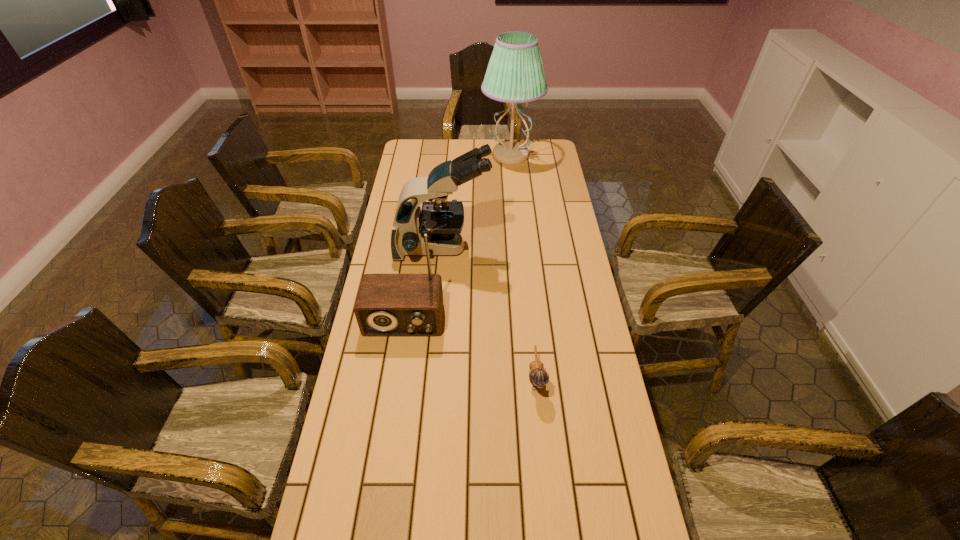
Identify the location of free location located 0.160m on the front-facing side of the second shortest object. (394, 385).

Find the location of a particular element. This screenshot has height=540, width=960. vacant space located on the front-facing side of the shortest object is located at coordinates (541, 429).

Locate an element on the screen. Image resolution: width=960 pixels, height=540 pixels. object present at the far edge is located at coordinates (515, 74).

At what (x,y) coordinates should I click in order to perform the action: click on microscope positioned at the left edge. Please return your answer as a coordinate pair (x, y). Image resolution: width=960 pixels, height=540 pixels. Looking at the image, I should click on (442, 220).

You are a GUI agent. You are given a task and a screenshot of the screen. Output one action in this format:
    pyautogui.click(x=<x>, y=<y>)
    Task: Click on the radio receiver at the left edge
    The height and width of the screenshot is (540, 960).
    Given the screenshot: What is the action you would take?
    pyautogui.click(x=387, y=304)

Where is `object that is positioned at the right edge`? object that is positioned at the right edge is located at coordinates (515, 74).

Find the location of a particular element. The width and height of the screenshot is (960, 540). object at the far right corner is located at coordinates (515, 74).

In the image, there is a desktop. Identify the location of vacant space at the far edge. (454, 154).

The width and height of the screenshot is (960, 540). In the image, there is a desktop. In order to click on vacant space at the left edge in this screenshot , I will do `click(405, 175)`.

Locate an element on the screen. vacant space at the right edge of the desktop is located at coordinates (602, 343).